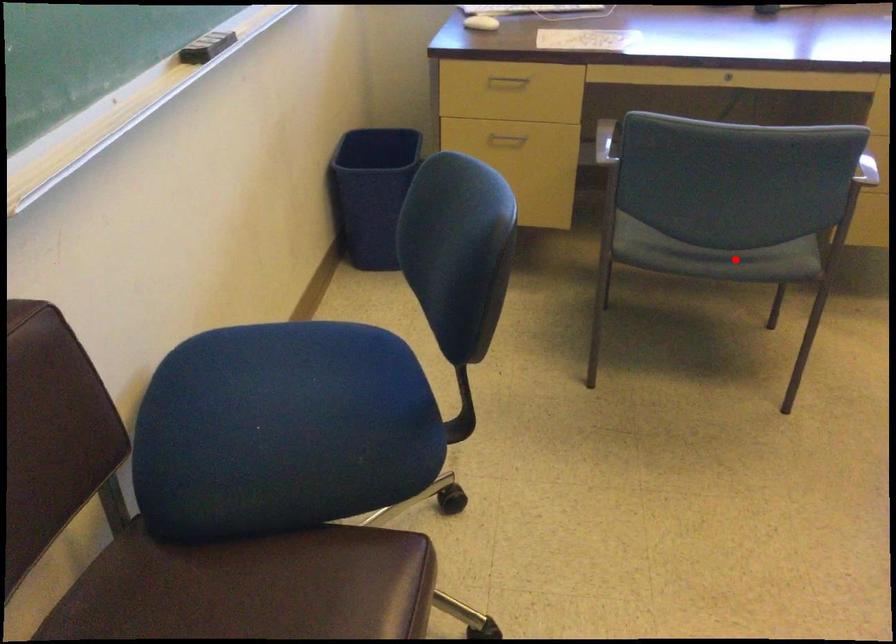
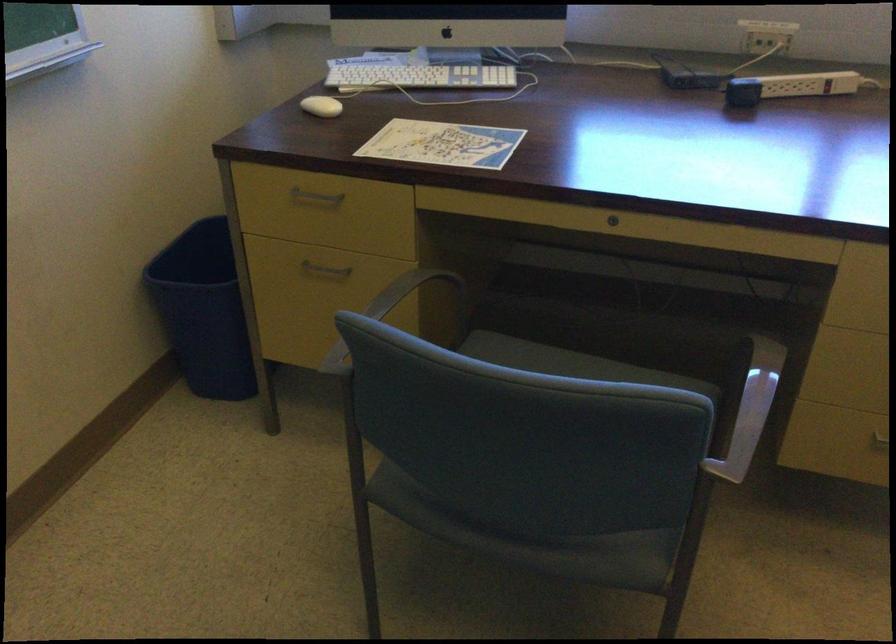
Question: I am providing you with two images of the same scene from different viewpoints. Image1 has a red point marked. In image2, the corresponding 3D location appears at what relative position? Reply with the corresponding letter.

Choices:
 (A) Closer
 (B) Farther

Answer: (A)